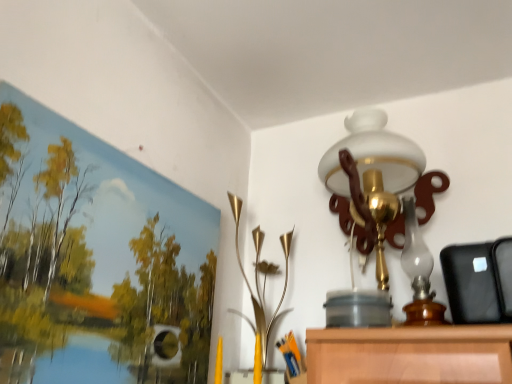
Question: Is the depth of white glass lamp at upper center, the first lamp from the right, less than that of gold metallic vase at center, the second lamp viewed from the right?

Choices:
 (A) no
 (B) yes

Answer: (B)

Question: Is white glass lamp at upper center, positioned as the second lamp in left-to-right order, touching gold metallic vase at center, the second lamp viewed from the right?

Choices:
 (A) no
 (B) yes

Answer: (A)

Question: Does white glass lamp at upper center, the first lamp from the right, have a greater width compared to gold metallic vase at center, which is the first lamp from left to right?

Choices:
 (A) no
 (B) yes

Answer: (B)

Question: Considering the relative positions of white glass lamp at upper center, the first lamp from the right, and gold metallic vase at center, which is the first lamp from left to right, in the image provided, is white glass lamp at upper center, the first lamp from the right, to the right of gold metallic vase at center, which is the first lamp from left to right, from the viewer's perspective?

Choices:
 (A) yes
 (B) no

Answer: (A)

Question: Is white glass lamp at upper center, positioned as the second lamp in left-to-right order, outside of gold metallic vase at center, the second lamp viewed from the right?

Choices:
 (A) no
 (B) yes

Answer: (B)

Question: Based on their sizes in the image, would you say gold metallic vase at center, the second lamp viewed from the right, is bigger or smaller than white glass lamp at upper center, the first lamp from the right?

Choices:
 (A) big
 (B) small

Answer: (B)

Question: Relative to white glass lamp at upper center, the first lamp from the right, is gold metallic vase at center, the second lamp viewed from the right, in front or behind?

Choices:
 (A) front
 (B) behind

Answer: (B)

Question: Is gold metallic vase at center, which is the first lamp from left to right, wider or thinner than white glass lamp at upper center, the first lamp from the right?

Choices:
 (A) wide
 (B) thin

Answer: (B)

Question: Is gold metallic vase at center, the second lamp viewed from the right, inside or outside of white glass lamp at upper center, positioned as the second lamp in left-to-right order?

Choices:
 (A) outside
 (B) inside

Answer: (A)

Question: In terms of size, does matte canvas landscape at upper left appear bigger or smaller than gold metallic vase at center, the second lamp viewed from the right?

Choices:
 (A) small
 (B) big

Answer: (A)

Question: Looking at their shapes, would you say matte canvas landscape at upper left is wider or thinner than gold metallic vase at center, which is the first lamp from left to right?

Choices:
 (A) wide
 (B) thin

Answer: (B)

Question: Is point (159, 205) positioned closer to the camera than point (256, 238)?

Choices:
 (A) closer
 (B) farther

Answer: (A)

Question: Considering the relative positions of matte canvas landscape at upper left and gold metallic vase at center, which is the first lamp from left to right, in the image provided, is matte canvas landscape at upper left to the left or to the right of gold metallic vase at center, which is the first lamp from left to right,?

Choices:
 (A) left
 (B) right

Answer: (A)

Question: Looking at their shapes, would you say matte canvas landscape at upper left is wider or thinner than white glass lamp at upper center, the first lamp from the right?

Choices:
 (A) wide
 (B) thin

Answer: (B)

Question: Would you say matte canvas landscape at upper left is to the left or to the right of white glass lamp at upper center, the first lamp from the right, in the picture?

Choices:
 (A) right
 (B) left

Answer: (B)